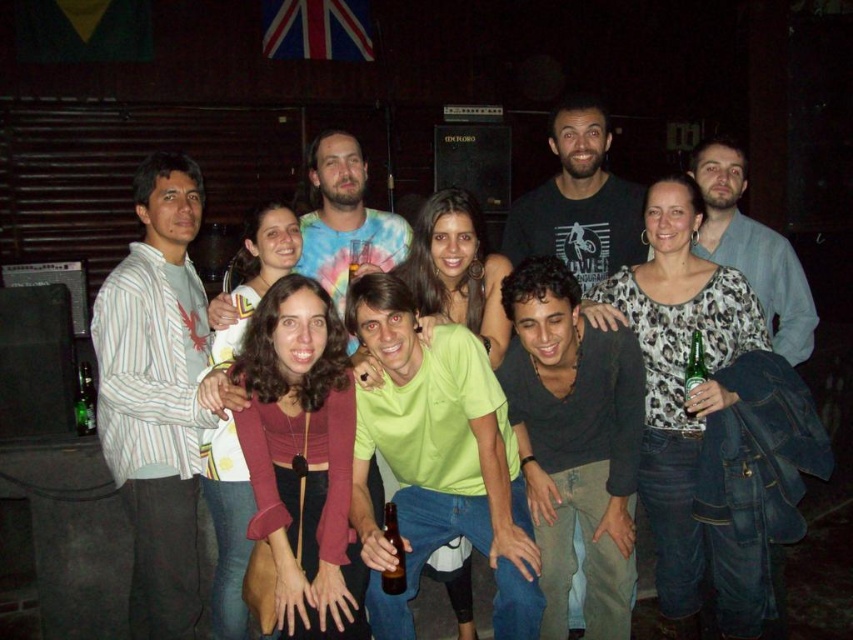
Question: Can you confirm if white striped shirt at left is positioned above tie-dye shirt at center?

Choices:
 (A) yes
 (B) no

Answer: (B)

Question: Estimate the real-world distances between objects in this image. Which object is farther from the lime green t-shirt at center?

Choices:
 (A) green glass bottle at lower left
 (B) brown glass bottle at center
 (C) black t-shirt at center
 (D) black matte shirt at center

Answer: (A)

Question: Observing the image, what is the correct spatial positioning of black matte shirt at center in reference to black t-shirt at center?

Choices:
 (A) above
 (B) below

Answer: (B)

Question: Does black matte shirt at center come behind black t-shirt at center?

Choices:
 (A) yes
 (B) no

Answer: (B)

Question: Which of the following is the farthest from the observer?

Choices:
 (A) black matte shirt at center
 (B) brown glass bottle at center
 (C) green glass bottle at lower left

Answer: (C)

Question: Which object is the closest to the black t-shirt at center?

Choices:
 (A) green glass bottle at lower left
 (B) lime green t-shirt at center
 (C) brown glass bottle at center
 (D) white striped shirt at left

Answer: (B)